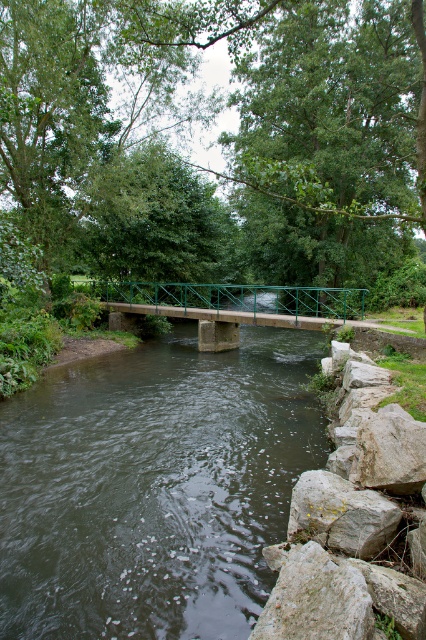
You are a hiker who wants to cross the river safely. You see the dark green water at center and the green metal bridge at center. Which object should you use to cross the river?

The green metal bridge at center is positioned over the dark green water at center, so you should use the green metal bridge at center to cross the river safely.

Consider the image. You are a hiker trying to cross the river. You see the dark green water at center and the green metal bridge at center. Which object should you step onto to safely cross the river?

You should step onto the green metal bridge at center to safely cross the river since it is a constructed pathway designed for crossing, while the dark green water at center is part of the river and may be unsafe to walk on.